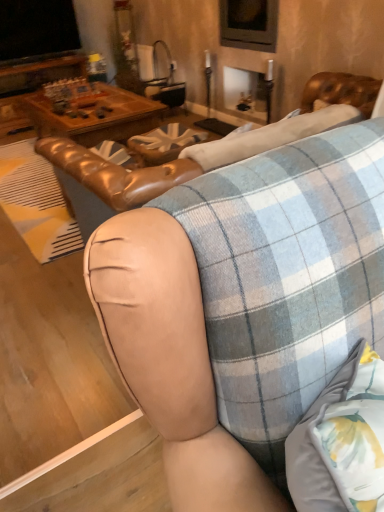
Question: Does leather at center have a greater height compared to leather couch at center?

Choices:
 (A) no
 (B) yes

Answer: (B)

Question: Considering the relative sizes of leather at center and leather couch at center in the image provided, is leather at center smaller than leather couch at center?

Choices:
 (A) yes
 (B) no

Answer: (B)

Question: Does leather at center lie behind leather couch at center?

Choices:
 (A) no
 (B) yes

Answer: (A)

Question: Is leather at center not near leather couch at center?

Choices:
 (A) no
 (B) yes

Answer: (A)

Question: Is leather at center closer to camera compared to leather couch at center?

Choices:
 (A) no
 (B) yes

Answer: (B)

Question: Is leather couch at center surrounded by leather at center?

Choices:
 (A) no
 (B) yes

Answer: (A)

Question: Considering the relative sizes of leather couch at center and leather at center in the image provided, is leather couch at center smaller than leather at center?

Choices:
 (A) no
 (B) yes

Answer: (B)

Question: Is leather couch at center looking in the opposite direction of leather at center?

Choices:
 (A) no
 (B) yes

Answer: (A)

Question: From the image's perspective, is leather couch at center over leather at center?

Choices:
 (A) no
 (B) yes

Answer: (B)

Question: From a real-world perspective, is leather couch at center located higher than leather at center?

Choices:
 (A) yes
 (B) no

Answer: (B)

Question: Is leather couch at center aimed at leather at center?

Choices:
 (A) yes
 (B) no

Answer: (B)

Question: Is leather couch at center surrounding leather at center?

Choices:
 (A) yes
 (B) no

Answer: (B)

Question: Based on their positions, is leather at center located to the left or right of leather couch at center?

Choices:
 (A) right
 (B) left

Answer: (A)